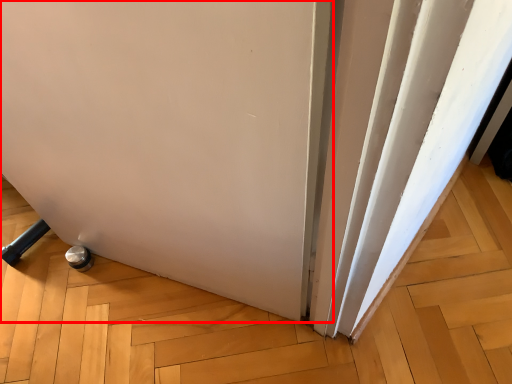
Question: From the image's perspective, what is the correct spatial positioning of door (annotated by the red box) in reference to curtain?

Choices:
 (A) below
 (B) above

Answer: (A)